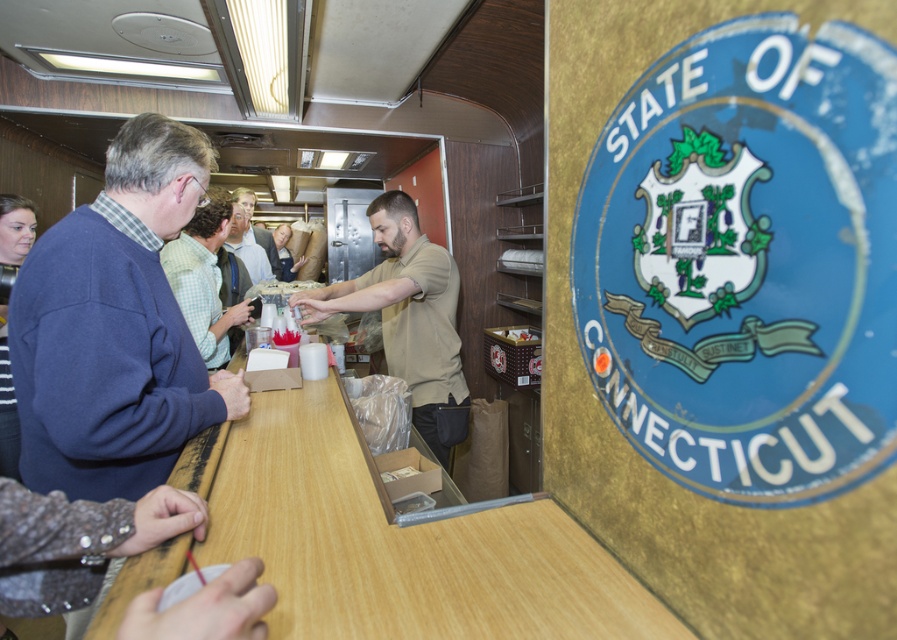
Between wooden at center and light brown shirt at center, which one appears on the left side from the viewer's perspective?

From the viewer's perspective, light brown shirt at center appears more on the left side.

Is wooden at center taller than light brown shirt at center?

No, wooden at center is not taller than light brown shirt at center.

Describe the element at coordinates (393, 540) in the screenshot. I see `wooden at center` at that location.

Locate an element on the screen. wooden at center is located at coordinates (393, 540).

This screenshot has height=640, width=897. What do you see at coordinates (408, 317) in the screenshot? I see `matte khaki shirt at center` at bounding box center [408, 317].

Measure the distance from matte khaki shirt at center to green plaid shirt at center.

56.87 centimeters

Is point (384, 228) positioned in front of point (223, 362)?

Yes, it is in front of point (223, 362).

Locate an element on the screen. The height and width of the screenshot is (640, 897). matte khaki shirt at center is located at coordinates (408, 317).

Is wooden at center shorter than white paper cup at center?

No, wooden at center is not shorter than white paper cup at center.

Measure the distance between point (598, 560) and camera.

Point (598, 560) and camera are 34.47 inches apart from each other.

This screenshot has height=640, width=897. I want to click on wooden at center, so click(393, 540).